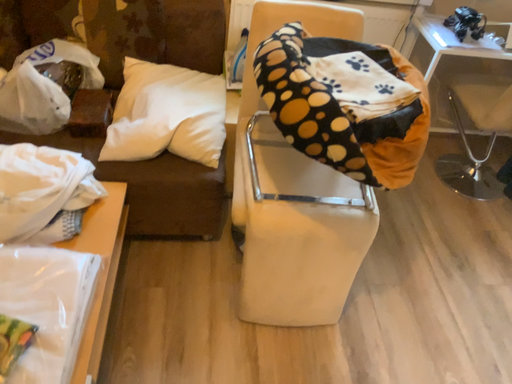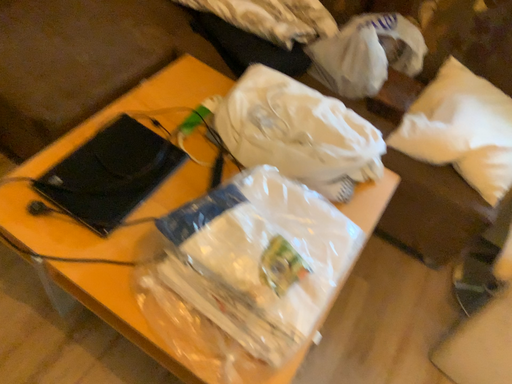
Question: Which way did the camera rotate in the video?

Choices:
 (A) rotated right
 (B) rotated left

Answer: (B)